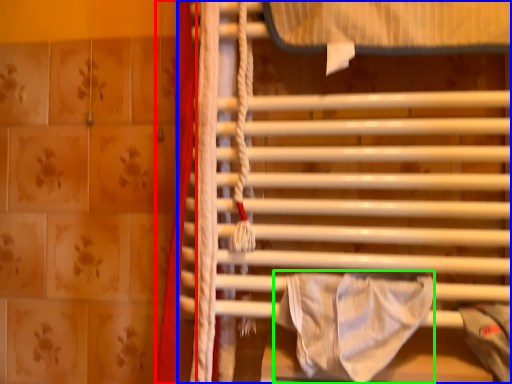
Question: Based on their relative distances, which object is farther from curtain (highlighted by a red box)? Choose from furniture (highlighted by a blue box) and blanket (highlighted by a green box).

Choices:
 (A) furniture
 (B) blanket

Answer: (B)